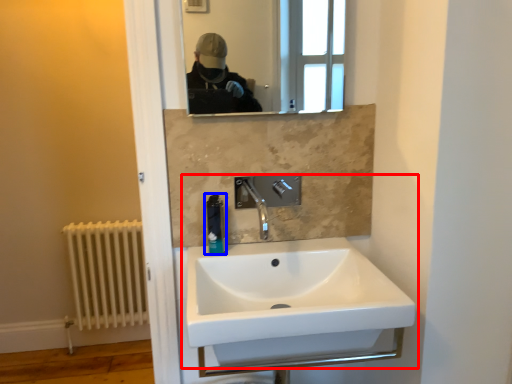
Question: Which point is closer to the camera, sink (highlighted by a red box) or soap dispenser (highlighted by a blue box)?

Choices:
 (A) sink
 (B) soap dispenser

Answer: (A)